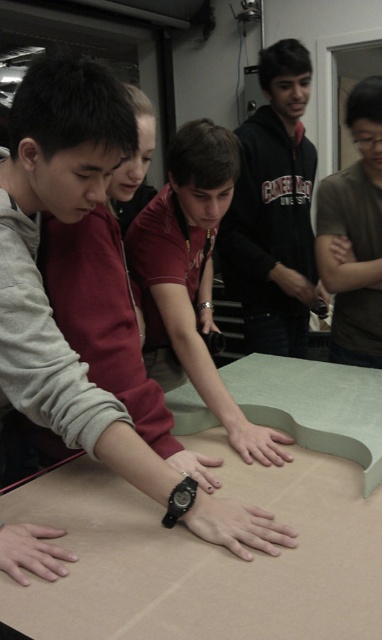
You are standing at the origin of the coordinate system in the image. The brown matte shirt at upper right is located at point (354,234). If you want to move directly towards the brown matte shirt at upper right, in which direction should you move?

The point (354,234) is located at the upper right of the image, so you should move towards the upper right direction to reach the brown matte shirt at upper right.

You are a photographer taking a picture of the scene. The brown matte shirt at upper right and the skinny white hand at center are in the frame. Which object should you focus on first if you want to capture both in sharp focus?

The brown matte shirt at upper right is much taller than the skinny white hand at center, so you should focus on the brown matte shirt at upper right first to ensure both are in sharp focus.